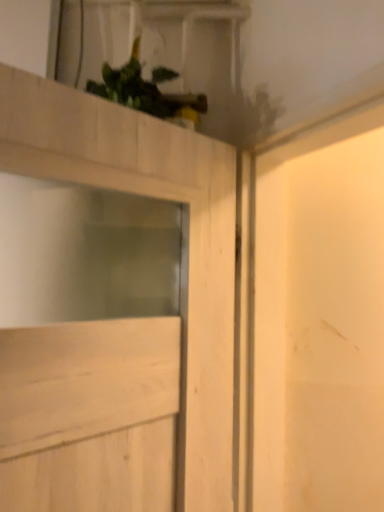
The width and height of the screenshot is (384, 512). Identify the location of green leafy plant at upper center. (147, 90).

Image resolution: width=384 pixels, height=512 pixels. Describe the element at coordinates (147, 90) in the screenshot. I see `green leafy plant at upper center` at that location.

In order to face green leafy plant at upper center, should I rotate leftwards or rightwards?

Rotate left and turn 5.562 degrees.

You are a GUI agent. You are given a task and a screenshot of the screen. Output one action in this format:
    pyautogui.click(x=<x>, y=<y>)
    Task: Click on the green leafy plant at upper center
    
    Given the screenshot: What is the action you would take?
    pyautogui.click(x=147, y=90)